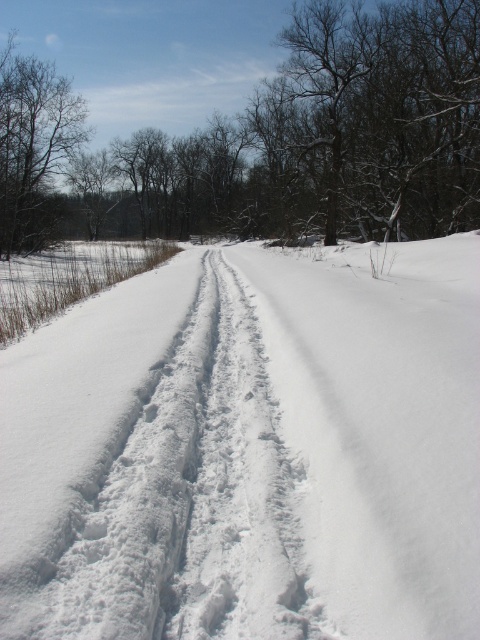
Who is more distant from viewer, (311, 209) or (39, 196)?

Point (39, 196)

Between point (13, 134) and point (27, 204), which one is positioned behind?

The point (27, 204) is behind.

What are the coordinates of `brown textured tree at upper center` in the screenshot? It's located at (271, 140).

Locate an element on the screen. The width and height of the screenshot is (480, 640). white fluffy snow at center is located at coordinates (250, 451).

Is white fluffy snow at center positioned in front of brown textured tree at upper center?

Yes, white fluffy snow at center is in front of brown textured tree at upper center.

Who is more forward, (132,278) or (267,131)?

Point (132,278)

I want to click on white fluffy snow at center, so click(250, 451).

Is point (36, 563) more distant than point (10, 220)?

No, it is in front of (10, 220).

Who is more forward, (x=192, y=586) or (x=7, y=244)?

Positioned in front is point (x=192, y=586).

Identify the location of white fluffy snow at center. (250, 451).